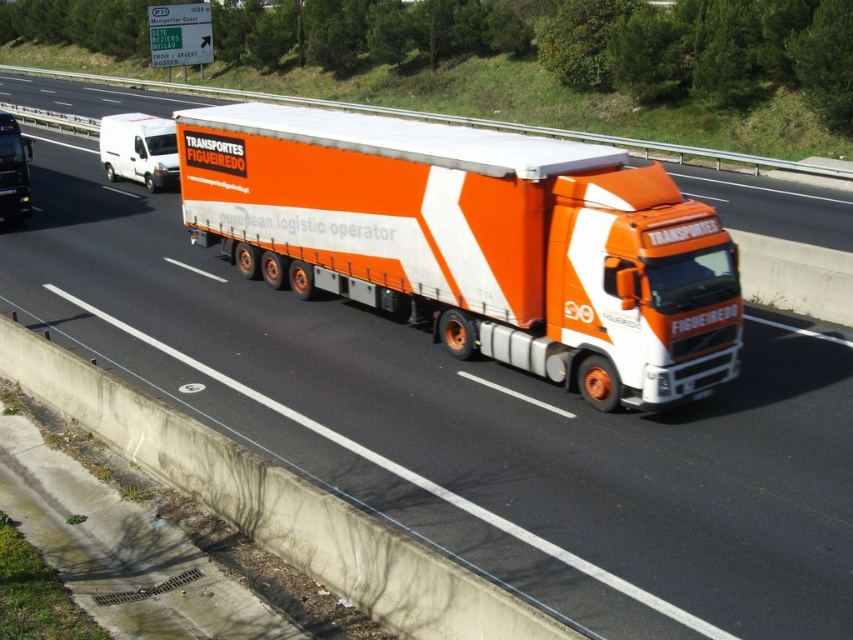
Looking at this image, you are a driver observing the highway scene. You see an orange matte trailer truck at center and a matte black truck at left. Which truck is larger in size?

The orange matte trailer truck at center is smaller than the matte black truck at left, so the matte black truck at left is larger in size.

You are a traffic officer observing a highway scene with an orange matte trailer truck at center and a matte black truck at left. Which truck is positioned lower in the image?

The orange matte trailer truck at center is located below the matte black truck at left, so it is positioned lower in the image.